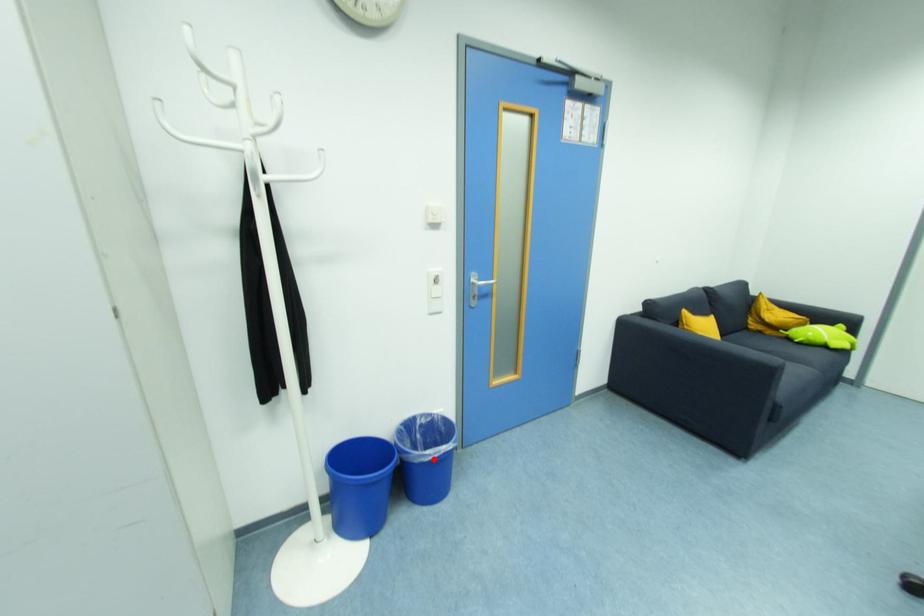
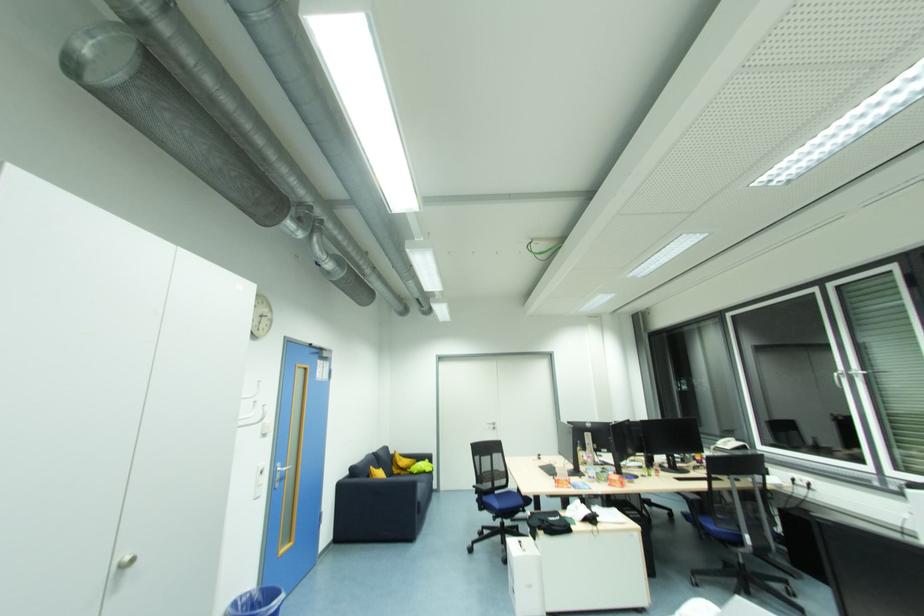
Locate, in the second image, the point that corresponds to the highlighted location in the first image.

(280, 607)